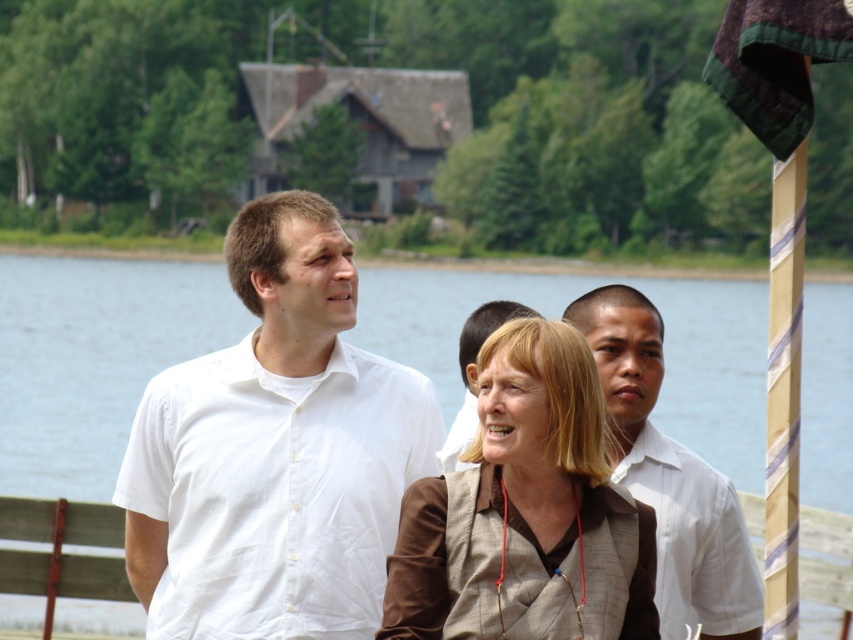
You are standing in the scene and want to move towards the two points marked in the image. Which point, point [180,385] or point [563,314], will you reach first?

Point [180,385] is closer to the viewer than point [563,314], so you will reach point [180,385] first.

You are planning to take a photo of the transparent water at center from the dock. Where should you position yourself to capture the water at the specified coordinates?

The transparent water at center is located at point (93, 358), so you should position yourself at that coordinate to capture it.

Based on the coordinates provided, where is the white cotton shirt at center located in the image?

The white cotton shirt at center is located at the coordinates point (276, 451).